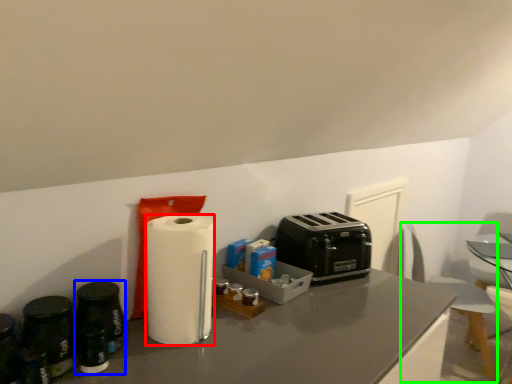
Question: Which object is positioned farthest from paper towel (highlighted by a red box)? Select from appliance (highlighted by a blue box) and swivel chair (highlighted by a green box).

Choices:
 (A) appliance
 (B) swivel chair

Answer: (B)